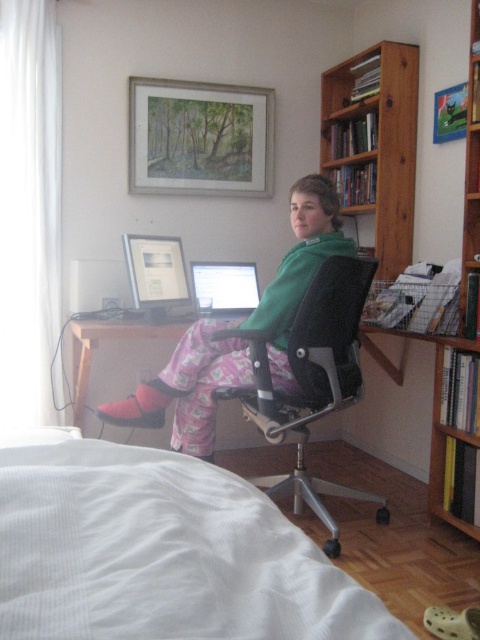
Is wooden bookshelf at right wider than metallic silver picture frame at upper right?

Correct, the width of wooden bookshelf at right exceeds that of metallic silver picture frame at upper right.

Is wooden bookshelf at right behind metallic silver picture frame at upper right?

No.

Is point (475, 52) farther from camera compared to point (459, 109)?

That is False.

Find the location of `wooden bookshelf at right`. wooden bookshelf at right is located at coordinates (462, 344).

Who is positioned more to the right, wooden bookshelf at upper right or metallic silver picture frame at upper right?

metallic silver picture frame at upper right

Is wooden bookshelf at upper right above metallic silver picture frame at upper right?

No.

At what (x,y) coordinates should I click in order to perform the action: click on wooden bookshelf at upper right. Please return your answer as a coordinate pair (x, y). This screenshot has height=640, width=480. Looking at the image, I should click on (376, 144).

Does matte wooden picture frame at upper center have a larger size compared to wooden desk at center?

No.

Does matte wooden picture frame at upper center appear under wooden desk at center?

No.

The image size is (480, 640). Identify the location of matte wooden picture frame at upper center. (200, 138).

Where is `matte wooden picture frame at upper center`? matte wooden picture frame at upper center is located at coordinates (200, 138).